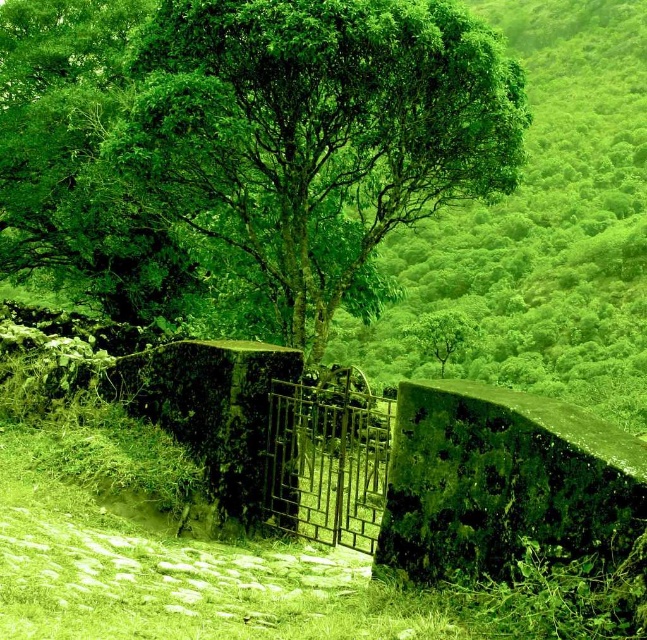
You are a gardener standing on the cobblestone pathway in the foreground. You need to water the green leafy tree at center and the rusty metal gate at center. Which one should you water first if you want to start with the one closer to you?

The green leafy tree at center is to the left of the rusty metal gate at center, so you should water the green leafy tree at center first since it is closer to you.